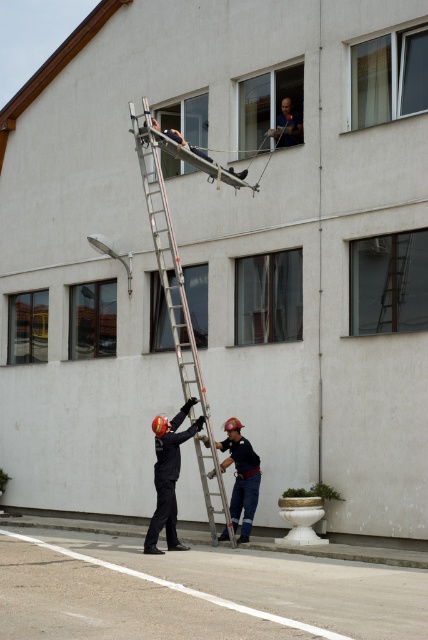
You are a firefighter on the ground looking up at the building. You need to determine which object is shorter between the white plastic window at upper center and the black matte helmet at center. Which one is shorter?

The white plastic window at upper center is shorter than the black matte helmet at center according to the description.

You are a firefighter trying to reach the person on the upper floor. You have two points marked on the building. Which point is closer to you, point [246,529] or point [14,358]?

Point [246,529] is closer to the viewer than point [14,358].